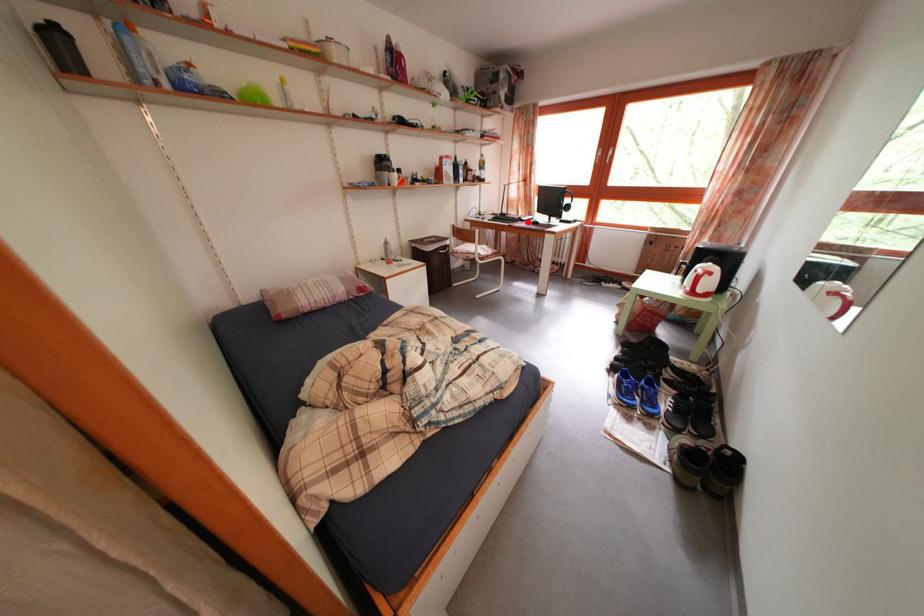
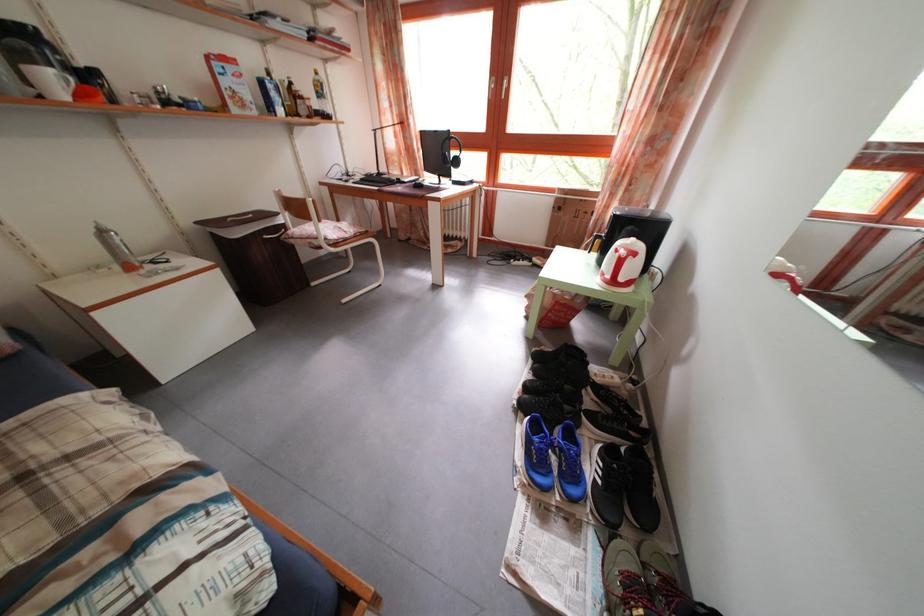
Question: I am providing you with two images of the same scene from different viewpoints. Image1 has a red point marked. In image2, the corresponding 3D location appears at what relative position? Reply with the corresponding letter.

Choices:
 (A) Closer
 (B) Farther

Answer: (B)